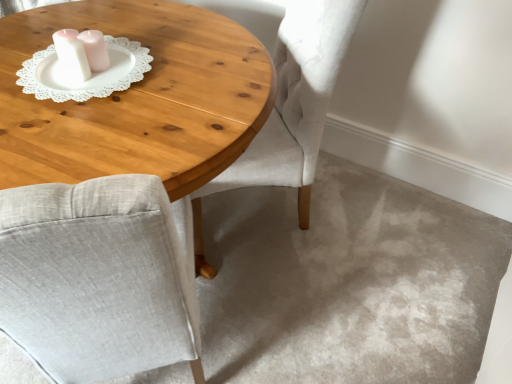
Question: Should I look upward or downward to see white lace doily at upper left?

Choices:
 (A) up
 (B) down

Answer: (A)

Question: Is wooden coffee table at center at the right side of light gray fabric chair at center?

Choices:
 (A) no
 (B) yes

Answer: (A)

Question: Is wooden coffee table at center thinner than light gray fabric chair at center?

Choices:
 (A) yes
 (B) no

Answer: (B)

Question: Considering the relative sizes of wooden coffee table at center and light gray fabric chair at center in the image provided, is wooden coffee table at center shorter than light gray fabric chair at center?

Choices:
 (A) no
 (B) yes

Answer: (B)

Question: Could you tell me if wooden coffee table at center is turned towards light gray fabric chair at center?

Choices:
 (A) no
 (B) yes

Answer: (A)

Question: From a real-world perspective, is wooden coffee table at center over light gray fabric chair at center?

Choices:
 (A) yes
 (B) no

Answer: (B)

Question: Does wooden coffee table at center have a greater width compared to light gray fabric chair at center?

Choices:
 (A) yes
 (B) no

Answer: (A)

Question: From a real-world perspective, is white lace doily at upper left over wooden coffee table at center?

Choices:
 (A) no
 (B) yes

Answer: (B)

Question: From the image's perspective, does white lace doily at upper left appear higher than wooden coffee table at center?

Choices:
 (A) yes
 (B) no

Answer: (A)

Question: Can you confirm if white lace doily at upper left is shorter than wooden coffee table at center?

Choices:
 (A) no
 (B) yes

Answer: (B)

Question: Does white lace doily at upper left have a greater height compared to wooden coffee table at center?

Choices:
 (A) no
 (B) yes

Answer: (A)

Question: Can you confirm if white lace doily at upper left is smaller than wooden coffee table at center?

Choices:
 (A) yes
 (B) no

Answer: (A)

Question: Can you confirm if white lace doily at upper left is bigger than wooden coffee table at center?

Choices:
 (A) yes
 (B) no

Answer: (B)

Question: From the image's perspective, is light gray fabric chair at center over wooden coffee table at center?

Choices:
 (A) no
 (B) yes

Answer: (B)